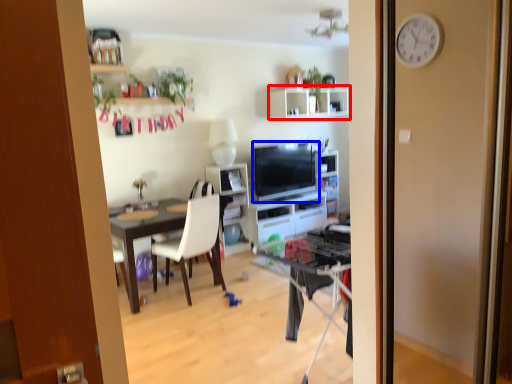
Question: Which object is closer to the camera taking this photo, shelf (highlighted by a red box) or television (highlighted by a blue box)?

Choices:
 (A) shelf
 (B) television

Answer: (B)